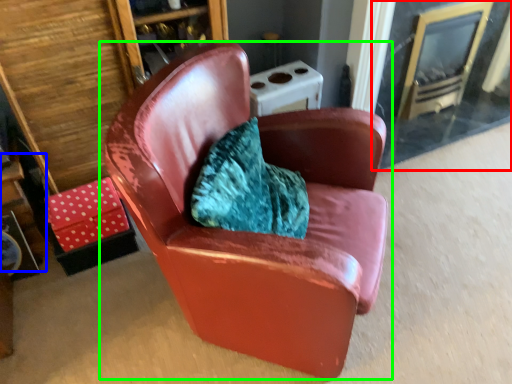
Question: Estimate the real-world distances between objects in this image. Which object is farther from glass door (highlighted by a red box), table (highlighted by a blue box) or chair (highlighted by a green box)?

Choices:
 (A) table
 (B) chair

Answer: (A)